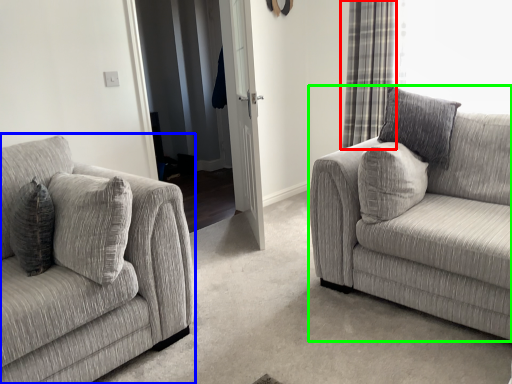
Question: Which object is positioned farthest from curtain (highlighted by a red box)? Select from studio couch (highlighted by a blue box) and studio couch (highlighted by a green box).

Choices:
 (A) studio couch
 (B) studio couch

Answer: (A)